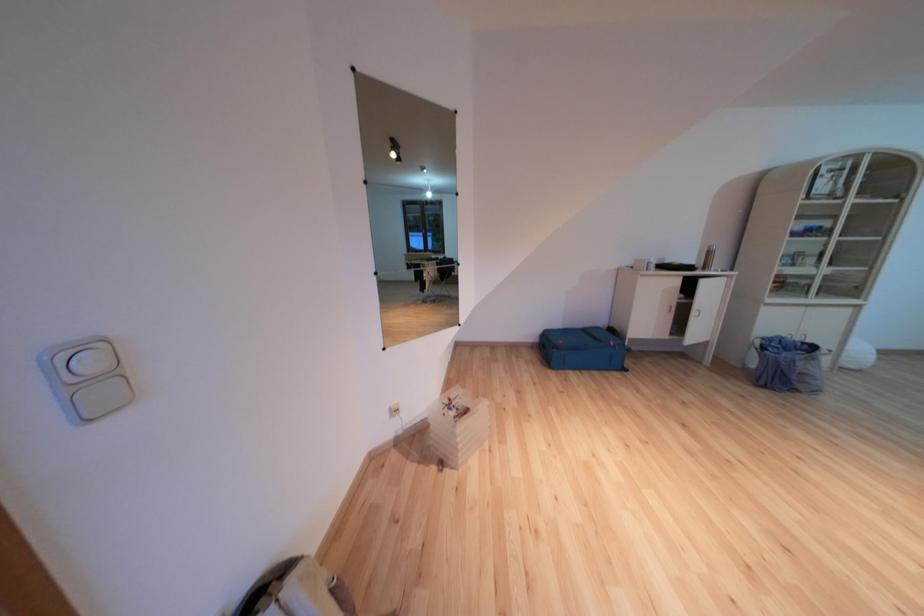
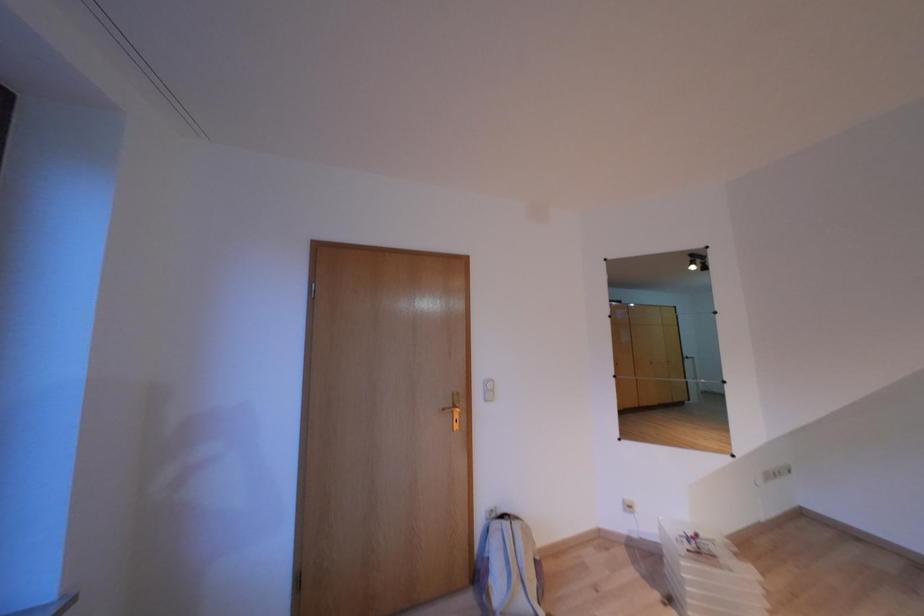
Question: The camera is either moving clockwise (left) or counter-clockwise (right) around the object. The first image is from the beginning of the video and the second image is from the end. Is the camera moving left or right when shooting the video?

Choices:
 (A) Left
 (B) Right

Answer: (B)